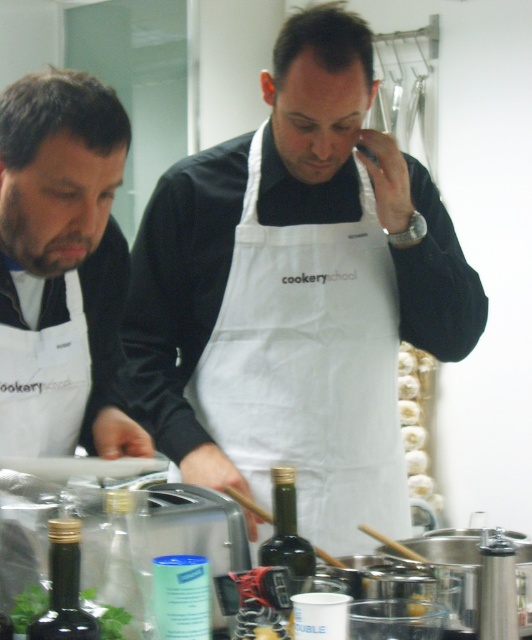
Based on the photo, is white glossy doughnuts at right taller than green glass bottle at center?

Indeed, white glossy doughnuts at right has a greater height compared to green glass bottle at center.

Does white glossy doughnuts at right have a greater width compared to green glass bottle at center?

Yes.

Where is `white glossy doughnuts at right`? The width and height of the screenshot is (532, 640). white glossy doughnuts at right is located at coordinates (415, 420).

Does white fabric apron at left have a lesser height compared to white glossy doughnuts at right?

Yes, white fabric apron at left is shorter than white glossy doughnuts at right.

Does white fabric apron at left appear under white glossy doughnuts at right?

No, white fabric apron at left is not below white glossy doughnuts at right.

Where is `white fabric apron at left`? Image resolution: width=532 pixels, height=640 pixels. white fabric apron at left is located at coordinates (45, 381).

At what (x,y) coordinates should I click in order to perform the action: click on white fabric apron at left. Please return your answer as a coordinate pair (x, y). Looking at the image, I should click on (45, 381).

Is dark green glass bottle at lower left above green glass bottle at center?

Indeed, dark green glass bottle at lower left is positioned over green glass bottle at center.

Between dark green glass bottle at lower left and green glass bottle at center, which one is positioned higher?

Positioned higher is dark green glass bottle at lower left.

Who is more distant from viewer, (95, 636) or (286, 476)?

Positioned behind is point (286, 476).

Identify the location of dark green glass bottle at lower left. (63, 588).